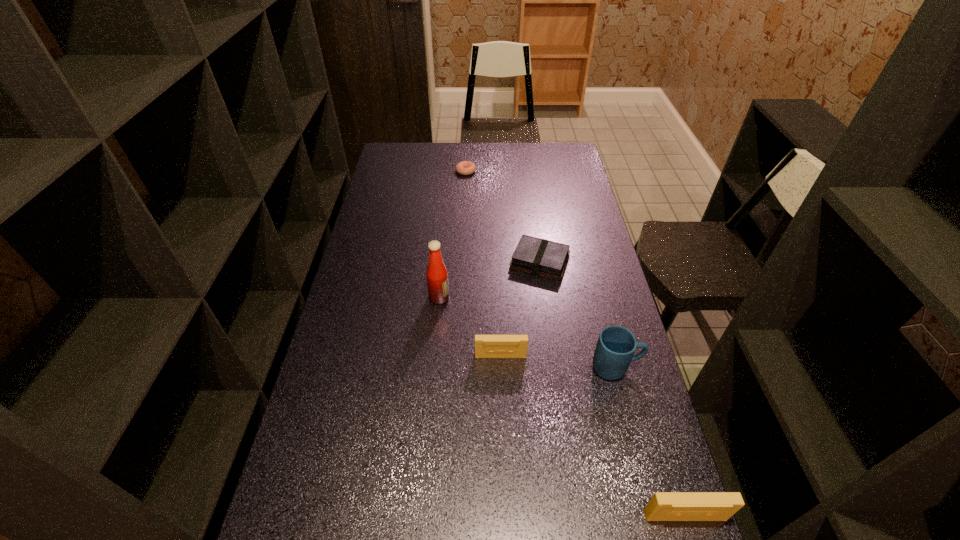
At what (x,y) coordinates should I click in order to perform the action: click on the left videotape. Please return your answer as a coordinate pair (x, y). The image size is (960, 540). Looking at the image, I should click on (486, 346).

In order to click on the shorter videotape in this screenshot , I will do `click(486, 346)`.

Identify the location of the nearest object. (664, 506).

In order to click on the taller videotape in this screenshot , I will do `click(664, 506)`.

In order to click on doughnut in this screenshot , I will do `click(465, 167)`.

Find the location of a particular element. the farthest object is located at coordinates (465, 167).

Find the location of a particular element. book is located at coordinates (540, 257).

This screenshot has width=960, height=540. In order to click on the fifth tallest object in this screenshot , I will do `click(540, 257)`.

Locate an element on the screen. This screenshot has width=960, height=540. the third farthest object is located at coordinates (437, 276).

This screenshot has height=540, width=960. What are the coordinates of `the tallest object` in the screenshot? It's located at (437, 276).